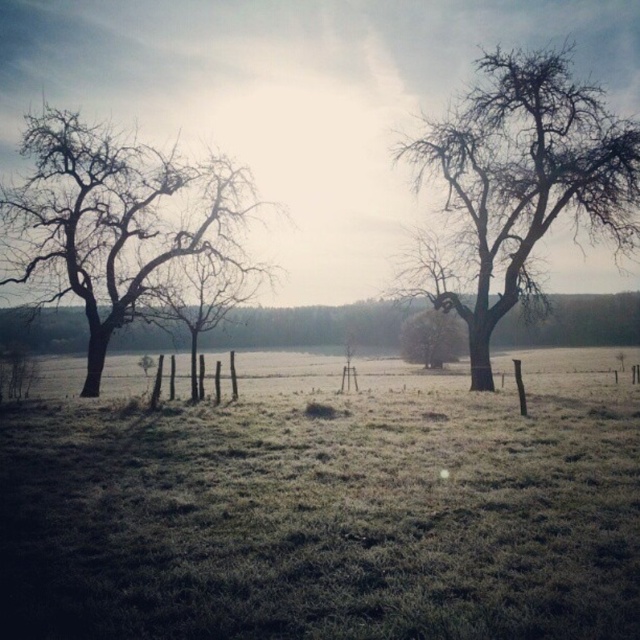
Question: Is bare branches at left positioned in front of brown matte tree at center?

Choices:
 (A) no
 (B) yes

Answer: (B)

Question: Which object appears farthest from the camera in this image?

Choices:
 (A) brown matte tree at center
 (B) bare branches at left
 (C) bare wood tree at upper right

Answer: (A)

Question: Is bare branches at left thinner than brown matte tree at center?

Choices:
 (A) no
 (B) yes

Answer: (A)

Question: Considering the real-world distances, which object is closest to the bare wood tree at upper right?

Choices:
 (A) brown matte tree at center
 (B) bare branches at left

Answer: (A)

Question: Where is bare wood tree at upper right located in relation to brown matte tree at center in the image?

Choices:
 (A) below
 (B) above

Answer: (B)

Question: Which object is closer to the camera taking this photo?

Choices:
 (A) bare wood tree at upper right
 (B) brown matte tree at center
 (C) bare branches at left

Answer: (C)